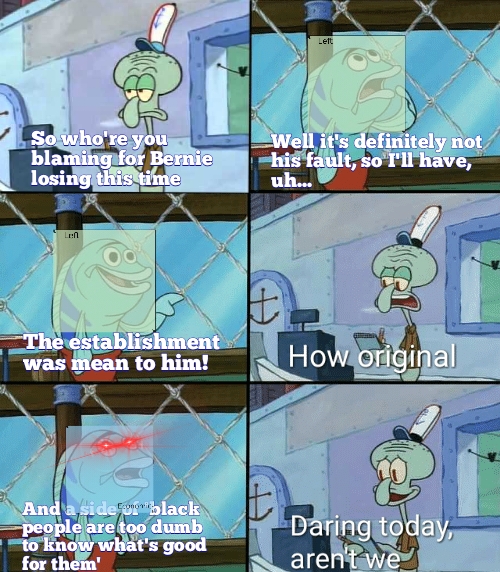
Find the location of a particular element. This screenshot has height=572, width=500. table is located at coordinates (4, 344), (17, 532), (262, 150).